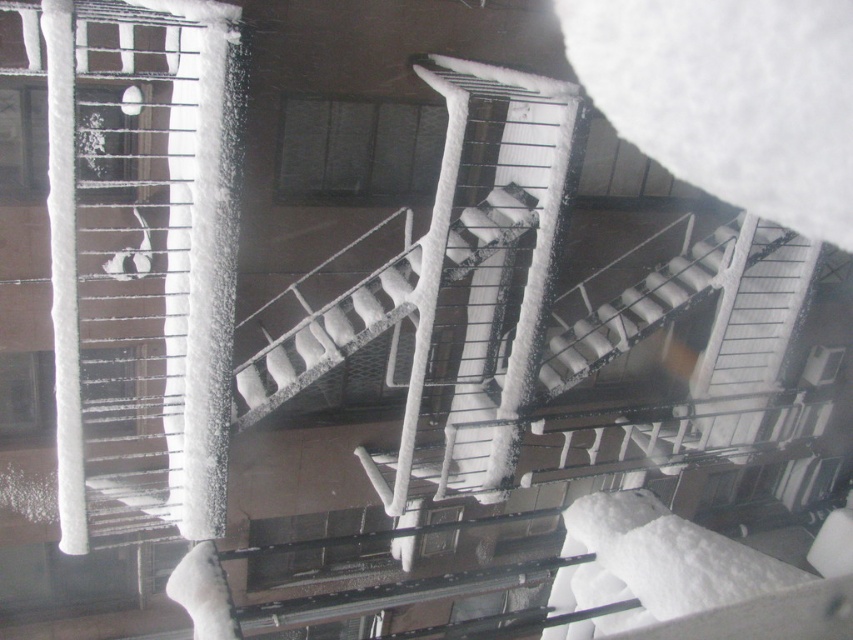
You are a delivery drone flying over a snowy city. You need to land on the snow covered metal stairs at center. The coordinates of the stairs are given as point (323,333). What are the coordinates of the snow covered metal stairs at center?

The snow covered metal stairs at center are located at coordinates point (323,333).